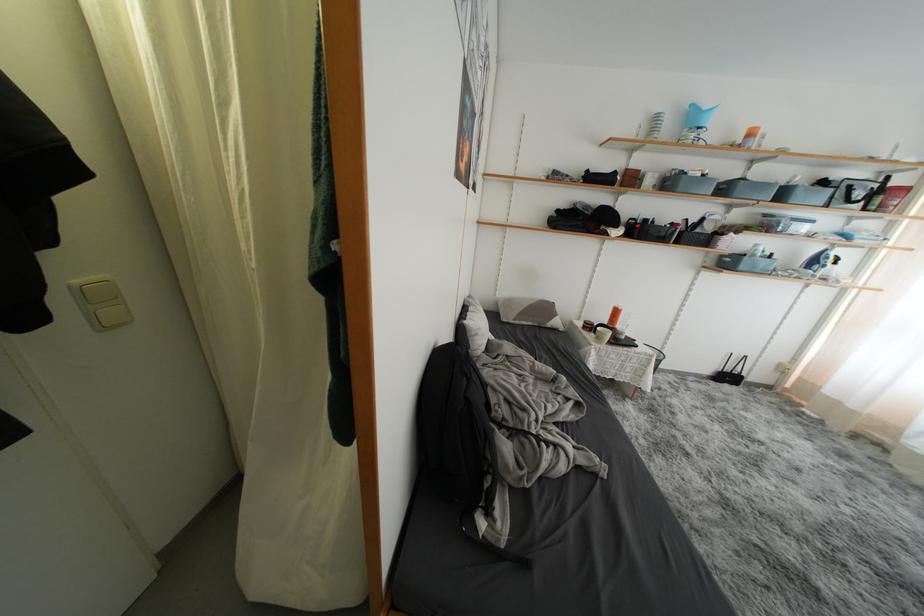
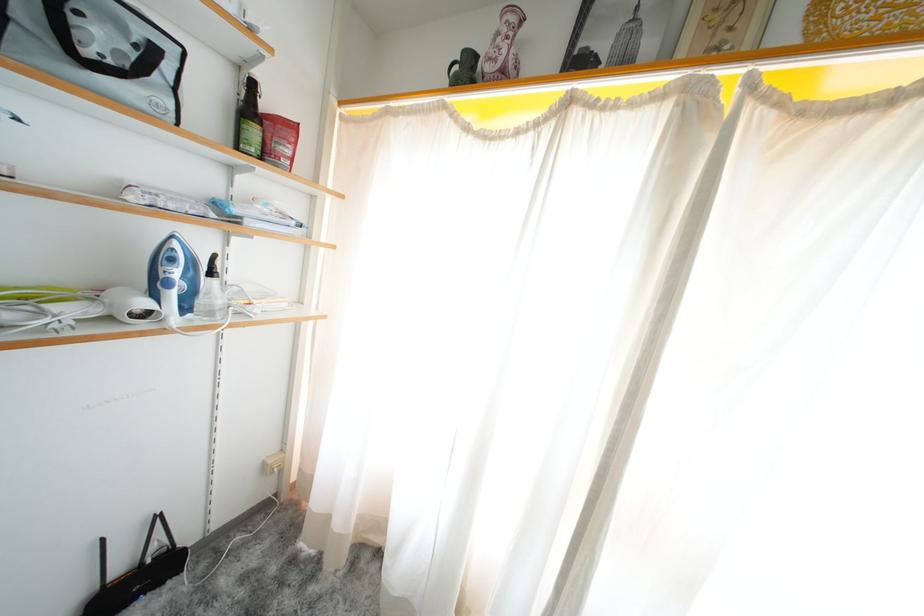
The point at [734,381] is marked in the first image. Where is the corresponding point in the second image?

(143, 586)